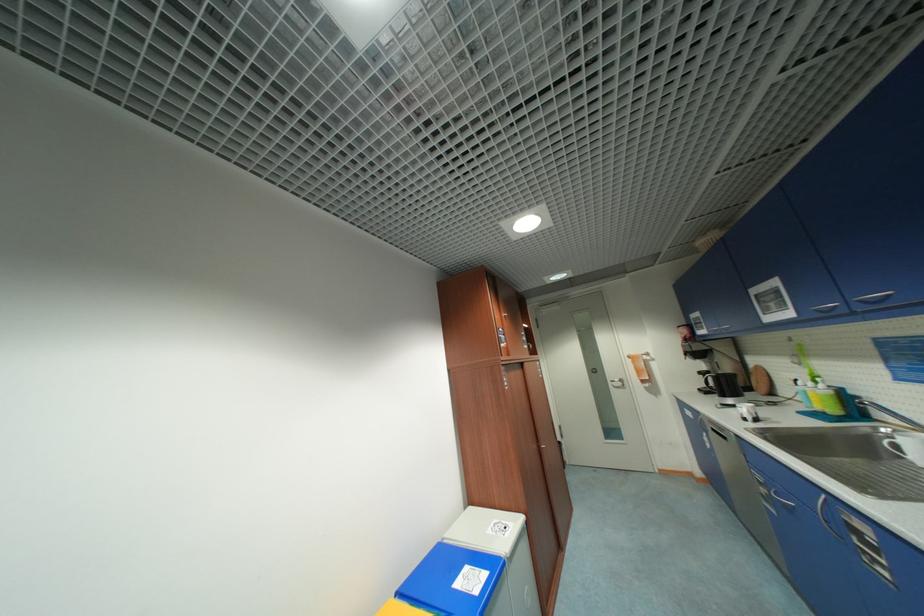
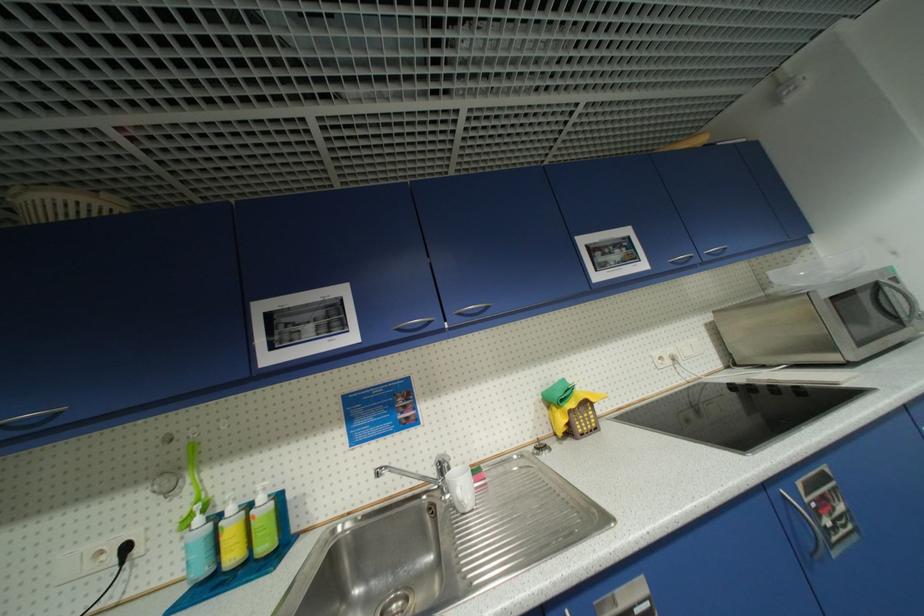
In the second image, find the point that corresponds to point (827, 387) in the first image.

(266, 500)